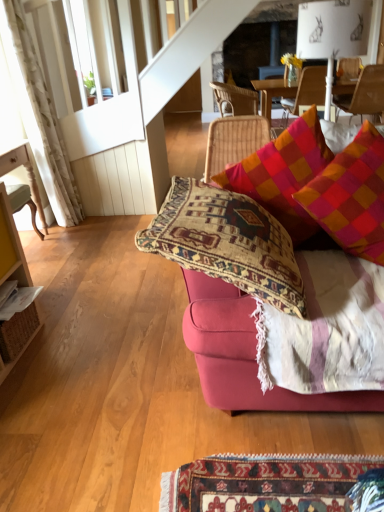
Where is `vacant area in front of white textured curtain at left`? The width and height of the screenshot is (384, 512). vacant area in front of white textured curtain at left is located at coordinates (80, 231).